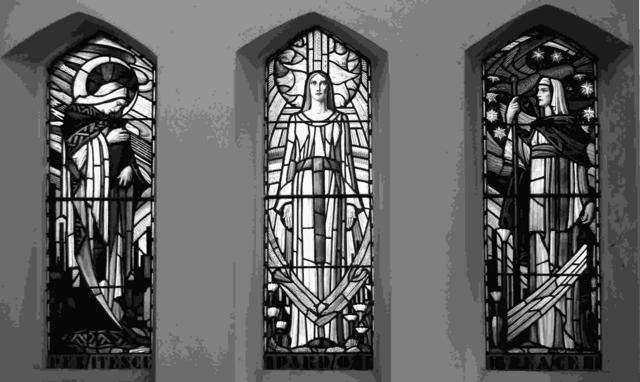
You are a GUI agent. You are given a task and a screenshot of the screen. Output one action in this format:
    pyautogui.click(x=<x>, y=<y>)
    Task: Click on the windows
    This screenshot has height=382, width=640.
    Given the screenshot: What is the action you would take?
    pyautogui.click(x=550, y=162), pyautogui.click(x=315, y=162), pyautogui.click(x=86, y=181)